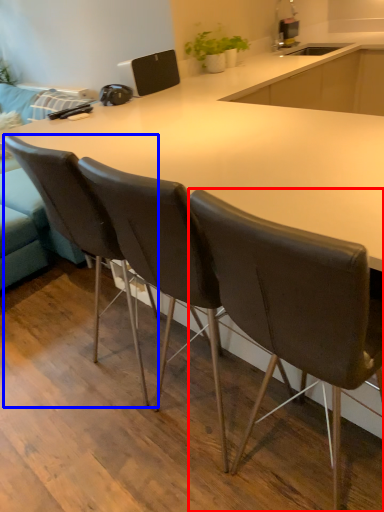
Question: Which object is further to the camera taking this photo, chair (highlighted by a red box) or chair (highlighted by a blue box)?

Choices:
 (A) chair
 (B) chair

Answer: (B)